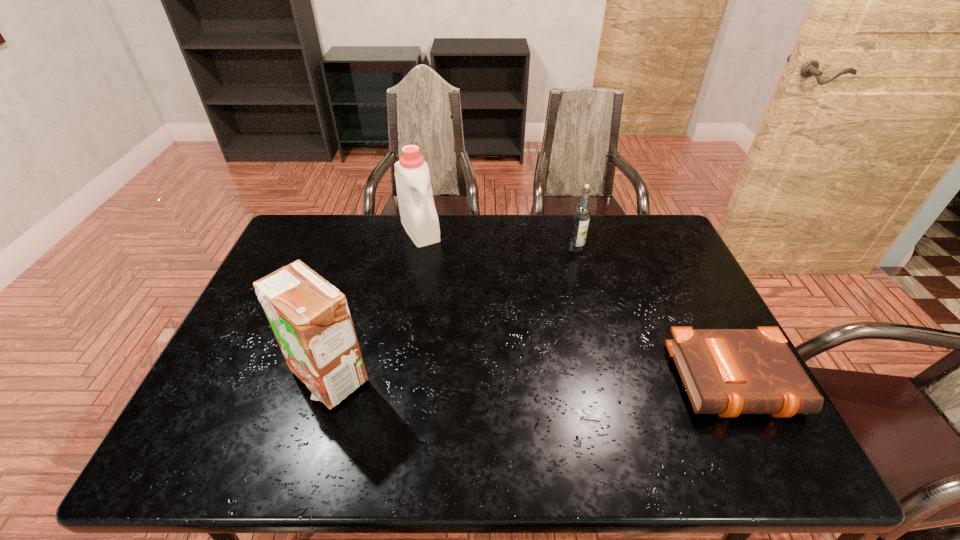
Find the location of a particular element. free area in between the detergent and the Bible is located at coordinates [580, 306].

Identify the location of unoccupied area between the shortest object and the detergent. (580, 306).

Find the location of `free area in between the third tallest object and the detergent`. free area in between the third tallest object and the detergent is located at coordinates (498, 239).

In order to click on free space between the carton and the detergent in this screenshot , I will do [374, 303].

Find the location of a particular element. Image resolution: width=960 pixels, height=540 pixels. free area in between the third tallest object and the detergent is located at coordinates (498, 239).

Select which object is the closest to the detergent. Please provide its 2D coordinates. Your answer should be formatted as a tuple, i.e. [(x, y)], where the tuple contains the x and y coordinates of a point satisfying the conditions above.

[(310, 319)]

Identify which object is located as the second nearest to the detergent. Please provide its 2D coordinates. Your answer should be formatted as a tuple, i.e. [(x, y)], where the tuple contains the x and y coordinates of a point satisfying the conditions above.

[(581, 216)]